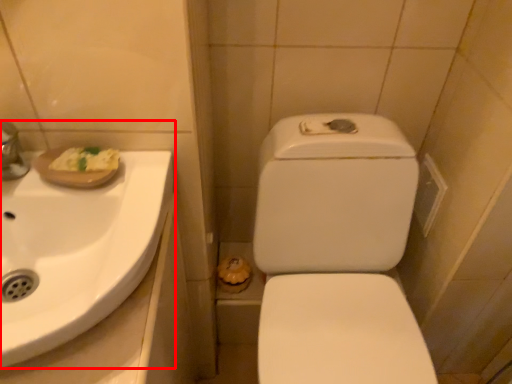
Question: In this image, where is sink (annotated by the red box) located relative to toilet?

Choices:
 (A) left
 (B) right

Answer: (A)